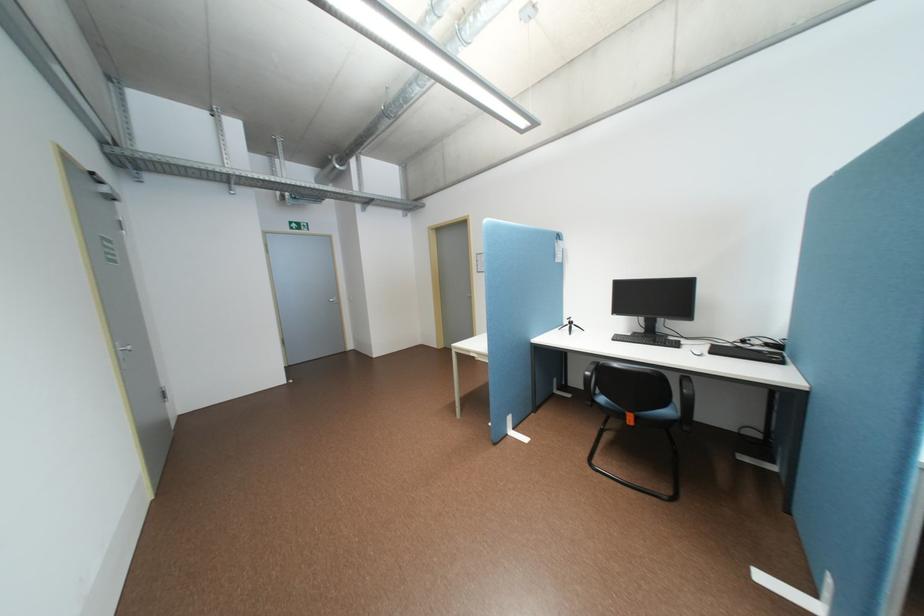
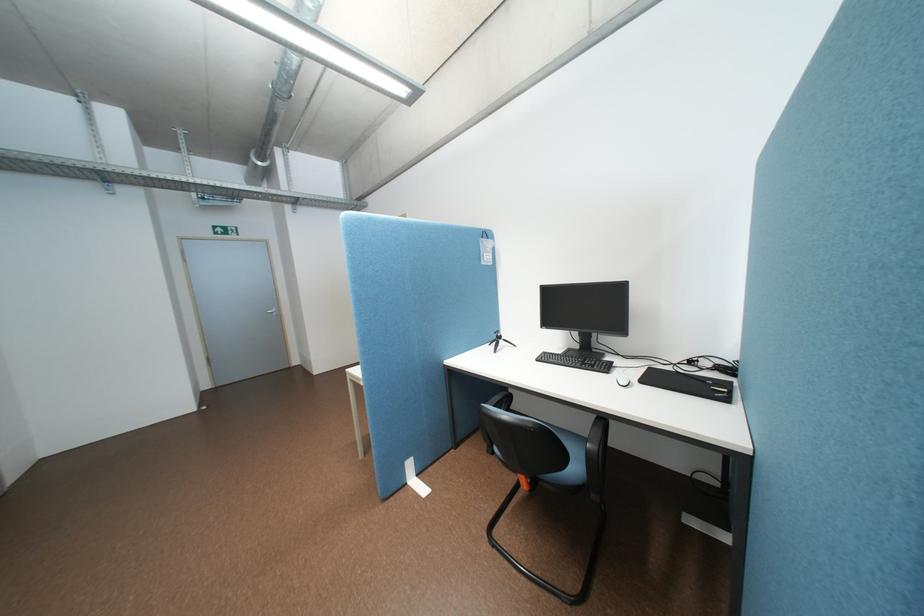
Which direction would the cameraman need to move to produce the second image?

The cameraman moved toward right, forward.